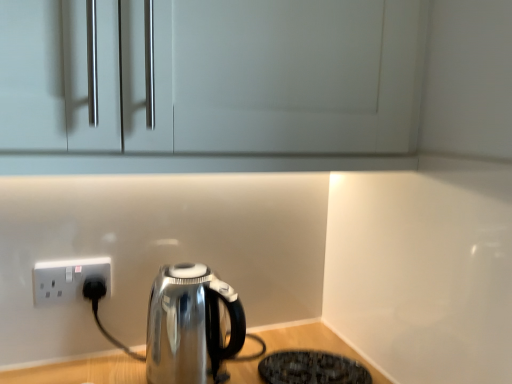
Question: Is point (202, 322) positioned closer to the camera than point (315, 359)?

Choices:
 (A) closer
 (B) farther

Answer: (A)

Question: Based on their positions, is shiny metallic kettle at lower left located to the left or right of black textured mat at lower right?

Choices:
 (A) left
 (B) right

Answer: (A)

Question: Which object is positioned farthest from the white plastic socket at lower left?

Choices:
 (A) black textured mat at lower right
 (B) shiny metallic kettle at lower left

Answer: (A)

Question: Considering the real-world distances, which object is farthest from the shiny metallic kettle at lower left?

Choices:
 (A) black textured mat at lower right
 (B) white plastic socket at lower left

Answer: (B)